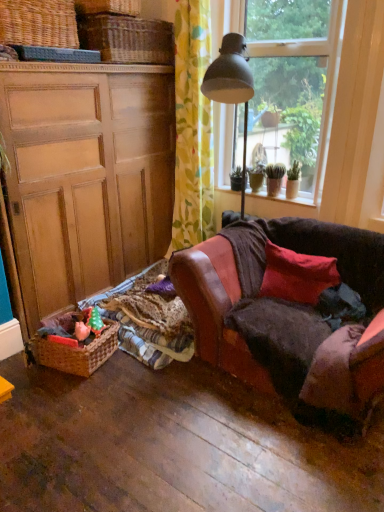
Where is `vacant region above plaid fabric blanket at lower left (from a real-world perspective)`? The image size is (384, 512). vacant region above plaid fabric blanket at lower left (from a real-world perspective) is located at coordinates (141, 300).